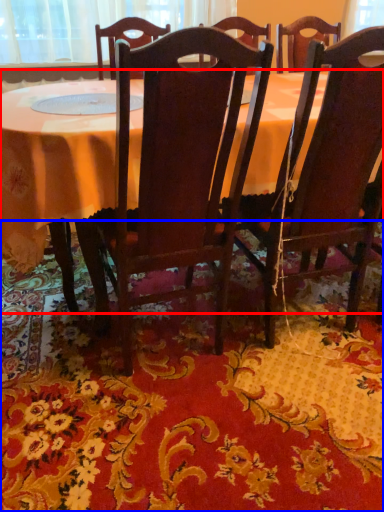
Question: Which point is further to the camera, table (highlighted by a red box) or mat (highlighted by a blue box)?

Choices:
 (A) table
 (B) mat

Answer: (A)